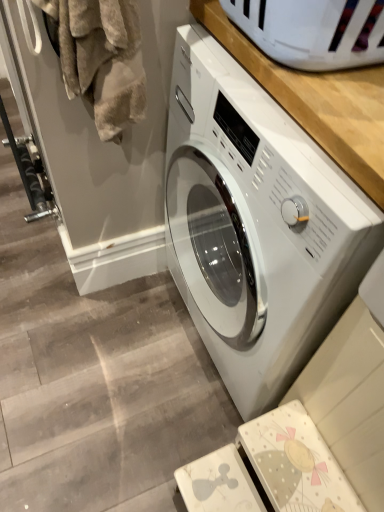
Question: Considering the relative positions of white glossy washing machine at center and fuzzy beige towel at left in the image provided, is white glossy washing machine at center to the right of fuzzy beige towel at left from the viewer's perspective?

Choices:
 (A) no
 (B) yes

Answer: (B)

Question: Is the surface of white glossy washing machine at center in direct contact with fuzzy beige towel at left?

Choices:
 (A) yes
 (B) no

Answer: (B)

Question: From the image's perspective, is white glossy washing machine at center above fuzzy beige towel at left?

Choices:
 (A) no
 (B) yes

Answer: (A)

Question: Is white glossy washing machine at center behind fuzzy beige towel at left?

Choices:
 (A) no
 (B) yes

Answer: (A)

Question: Considering the relative sizes of white glossy washing machine at center and fuzzy beige towel at left in the image provided, is white glossy washing machine at center wider than fuzzy beige towel at left?

Choices:
 (A) no
 (B) yes

Answer: (B)

Question: Could you tell me if white glossy washing machine at center is facing fuzzy beige towel at left?

Choices:
 (A) yes
 (B) no

Answer: (A)

Question: From the image's perspective, would you say fuzzy beige towel at left is positioned over white glossy washing machine at center?

Choices:
 (A) no
 (B) yes

Answer: (B)

Question: Would you consider fuzzy beige towel at left to be distant from white glossy washing machine at center?

Choices:
 (A) no
 (B) yes

Answer: (A)

Question: From a real-world perspective, does fuzzy beige towel at left sit lower than white glossy washing machine at center?

Choices:
 (A) no
 (B) yes

Answer: (A)

Question: Does fuzzy beige towel at left have a larger size compared to white glossy washing machine at center?

Choices:
 (A) yes
 (B) no

Answer: (B)

Question: Does fuzzy beige towel at left turn towards white glossy washing machine at center?

Choices:
 (A) yes
 (B) no

Answer: (B)

Question: Does fuzzy beige towel at left touch white glossy washing machine at center?

Choices:
 (A) no
 (B) yes

Answer: (A)

Question: Is fuzzy beige towel at left situated inside white glossy washing machine at center or outside?

Choices:
 (A) inside
 (B) outside

Answer: (B)